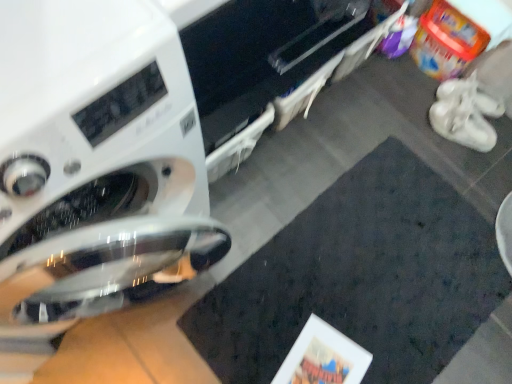
Where is `vacant space that is in between white suede sneakers at right and dark matte mat at center`? This screenshot has width=512, height=384. vacant space that is in between white suede sneakers at right and dark matte mat at center is located at coordinates (458, 164).